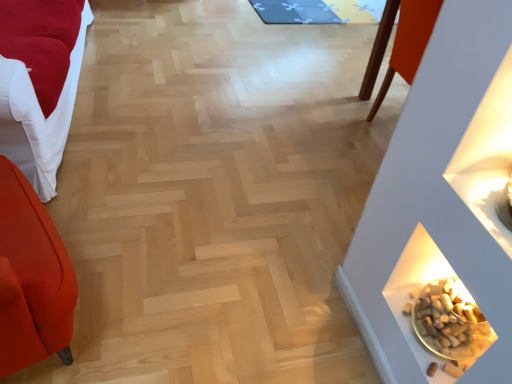
Question: Considering the relative sizes of brown cork at lower right and velvet red sofa at left in the image provided, is brown cork at lower right wider than velvet red sofa at left?

Choices:
 (A) no
 (B) yes

Answer: (A)

Question: Is brown cork at lower right closer to the viewer compared to velvet red sofa at left?

Choices:
 (A) no
 (B) yes

Answer: (A)

Question: Is velvet red sofa at left located within brown cork at lower right?

Choices:
 (A) yes
 (B) no

Answer: (B)

Question: Considering the relative positions of brown cork at lower right and velvet red sofa at left in the image provided, is brown cork at lower right behind velvet red sofa at left?

Choices:
 (A) yes
 (B) no

Answer: (A)

Question: Is brown cork at lower right at the right side of velvet red sofa at left?

Choices:
 (A) yes
 (B) no

Answer: (A)

Question: From a real-world perspective, is brown cork at lower right on velvet red sofa at left?

Choices:
 (A) yes
 (B) no

Answer: (B)

Question: Is velvet red sofa at left looking in the opposite direction of blue fabric mat at upper center?

Choices:
 (A) yes
 (B) no

Answer: (B)

Question: Does velvet red sofa at left have a greater height compared to blue fabric mat at upper center?

Choices:
 (A) no
 (B) yes

Answer: (B)

Question: Considering the relative positions of velvet red sofa at left and blue fabric mat at upper center in the image provided, is velvet red sofa at left to the right of blue fabric mat at upper center from the viewer's perspective?

Choices:
 (A) no
 (B) yes

Answer: (A)

Question: Can you confirm if velvet red sofa at left is bigger than blue fabric mat at upper center?

Choices:
 (A) no
 (B) yes

Answer: (B)

Question: Are velvet red sofa at left and blue fabric mat at upper center beside each other?

Choices:
 (A) yes
 (B) no

Answer: (B)

Question: Is velvet red sofa at left shorter than blue fabric mat at upper center?

Choices:
 (A) yes
 (B) no

Answer: (B)

Question: Is brown cork at lower right surrounding blue fabric mat at upper center?

Choices:
 (A) yes
 (B) no

Answer: (B)